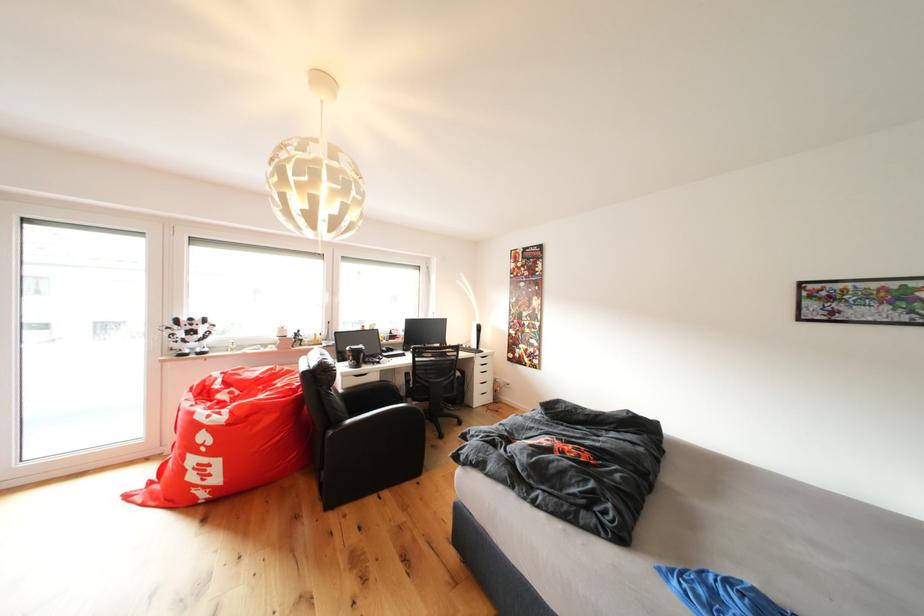
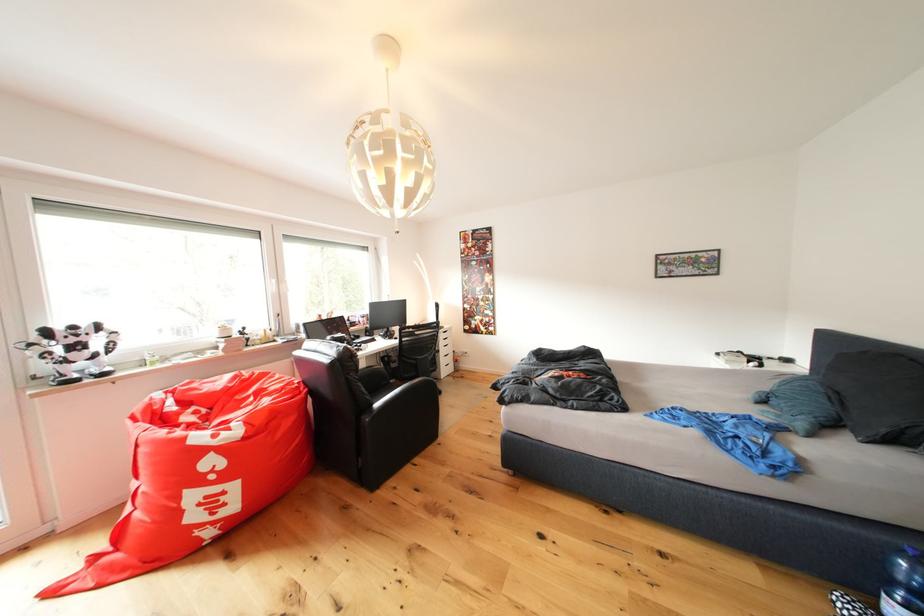
Question: The first image is from the beginning of the video and the second image is from the end. How did the camera likely rotate when shooting the video?

Choices:
 (A) Left
 (B) Right
 (C) Up
 (D) Down

Answer: (B)